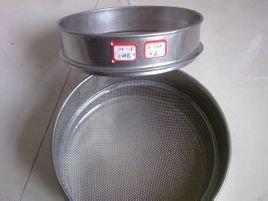
The height and width of the screenshot is (201, 268). Find the location of `white wall`. white wall is located at coordinates (16, 20).